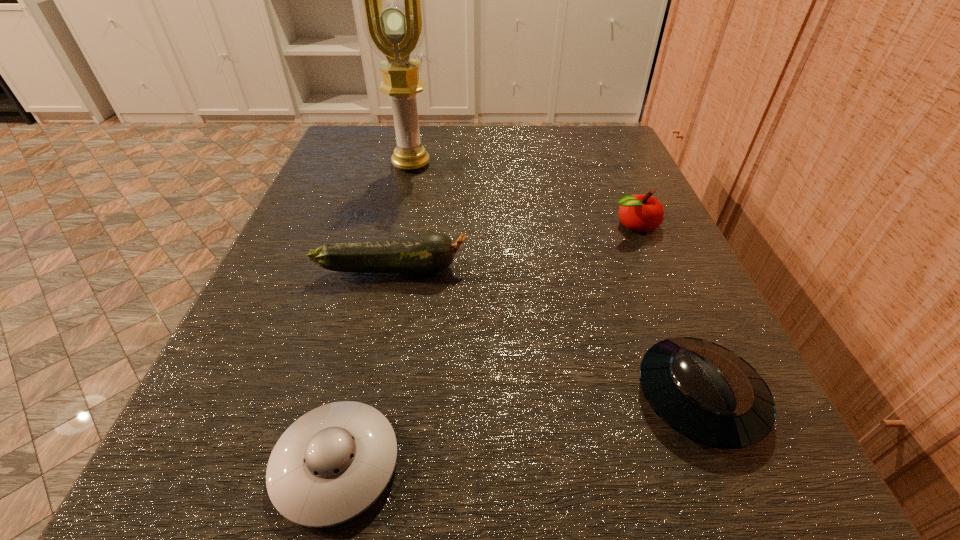
Select which object appears as the closest to the right saucer. Please provide its 2D coordinates. Your answer should be formatted as a tuple, i.e. [(x, y)], where the tuple contains the x and y coordinates of a point satisfying the conditions above.

[(642, 213)]

Where is `vacant space that satisfies the following two spatial constraints: 1. on the back side of the shorter saucer; 2. on the left side of the right saucer`? Image resolution: width=960 pixels, height=540 pixels. vacant space that satisfies the following two spatial constraints: 1. on the back side of the shorter saucer; 2. on the left side of the right saucer is located at coordinates (352, 397).

Identify the location of vacant area in the image that satisfies the following two spatial constraints: 1. on the front-facing side of the tallest object; 2. on the right side of the right saucer. This screenshot has width=960, height=540. (358, 397).

The image size is (960, 540). In order to click on vacant area in the image that satisfies the following two spatial constraints: 1. at the blossom end of the third nearest object; 2. on the right side of the right saucer in this screenshot , I will do `click(365, 397)`.

Find the location of a particular element. The image size is (960, 540). free spot that satisfies the following two spatial constraints: 1. at the blossom end of the zucchini; 2. on the back side of the right saucer is located at coordinates (365, 397).